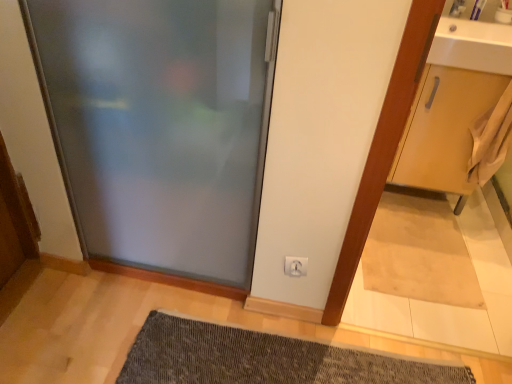
Question: Is point (155, 336) closer or farther from the camera than point (492, 54)?

Choices:
 (A) farther
 (B) closer

Answer: (B)

Question: In terms of width, does dark gray textured bath mat at lower center look wider or thinner when compared to white glossy sink at upper right?

Choices:
 (A) wide
 (B) thin

Answer: (A)

Question: Which of these objects is positioned closest to the dark gray textured bath mat at lower center?

Choices:
 (A) frosted glass door at center
 (B) white plastic electric outlet at lower center
 (C) light brown wood cabinet at right
 (D) beige fabric doormat at lower right
 (E) white glossy sink at upper right

Answer: (B)

Question: Estimate the real-world distances between objects in this image. Which object is farther from the frosted glass door at center?

Choices:
 (A) dark gray textured bath mat at lower center
 (B) beige fabric doormat at lower right
 (C) light brown wood cabinet at right
 (D) white plastic electric outlet at lower center
 (E) white glossy sink at upper right

Answer: (E)